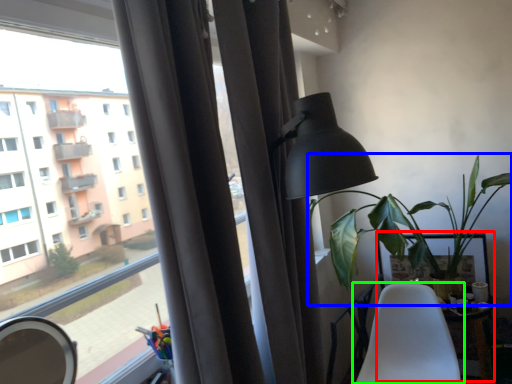
Question: Which object is positioned closest to table (highlighted by a red box)? Select from houseplant (highlighted by a blue box) and chair (highlighted by a green box).

Choices:
 (A) houseplant
 (B) chair

Answer: (B)